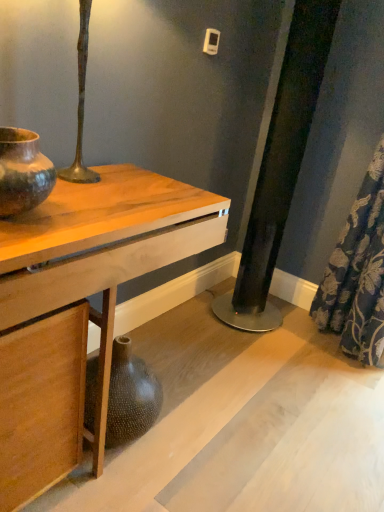
The image size is (384, 512). In order to click on vacant region below matte brown ceramic vase at left (from a real-world perspective) in this screenshot , I will do `click(30, 218)`.